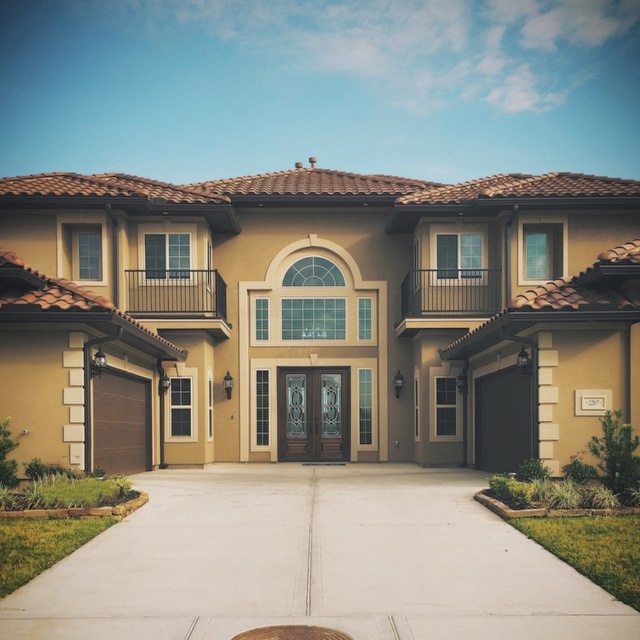
You are standing in front of the house and notice the concrete at center and the metallic gray manhole cover at center. Which object is closer to you?

The concrete at center is closer to you than the metallic gray manhole cover at center because it is further to the viewer.

You are a delivery person approaching the house and need to park your vehicle. The driveway is made of concrete at center. Where is the metallic gray manhole cover at center located in relation to the driveway?

The metallic gray manhole cover at center is to the right of the concrete at center driveway.

You are standing in front of the house and want to reach the point marked at coordinates point (593,625). Given that the house is 10 meters wide, can you estimate whether this point is located on the left or right side of the house?

The point (593,625) is 5.69 meters away from the viewer. Since the house is 10 meters wide, the point is likely on the right side of the house because it is closer to the right edge than the left edge based on the coordinate system where higher x values indicate rightward direction.